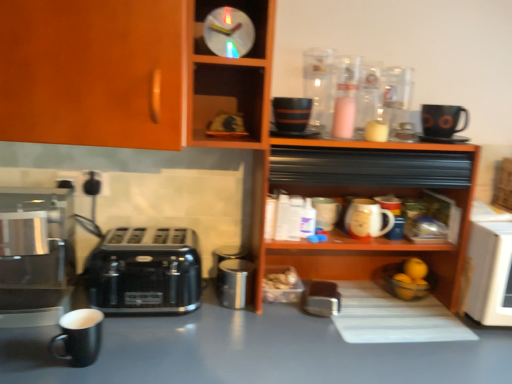
At what (x,y) coordinates should I click in order to perform the action: click on metallic silver canister at center. Please return your answer as a coordinate pair (x, y). The height and width of the screenshot is (384, 512). Looking at the image, I should click on (234, 283).

Identify the location of shiny metallic coffee maker at left. This screenshot has height=384, width=512. (35, 255).

The image size is (512, 384). What do you see at coordinates (144, 271) in the screenshot? I see `black plastic toaster at lower left` at bounding box center [144, 271].

Where is `matte wooden plate at upper center, which is the first cabinetry in right-to-left order`? matte wooden plate at upper center, which is the first cabinetry in right-to-left order is located at coordinates (x=230, y=77).

What do you see at coordinates (230, 77) in the screenshot? The image size is (512, 384). I see `matte wooden plate at upper center, the second cabinetry positioned from the left` at bounding box center [230, 77].

Image resolution: width=512 pixels, height=384 pixels. What do you see at coordinates (126, 74) in the screenshot?
I see `wooden cabinet at upper left, which ranks as the second cabinetry in right-to-left order` at bounding box center [126, 74].

The width and height of the screenshot is (512, 384). I want to click on translucent plastic clock at upper center, so click(228, 32).

What do you see at coordinates (228, 32) in the screenshot? I see `translucent plastic clock at upper center` at bounding box center [228, 32].

You are a GUI agent. You are given a task and a screenshot of the screen. Output one action in this format:
    pyautogui.click(x=<x>, y=<y>)
    Task: Click on the matte ceramic mug at shelf center
    This screenshot has width=512, height=384.
    Given the screenshot: What is the action you would take?
    pyautogui.click(x=367, y=219)

Which of these two, wooden cabinet at upper left, which ranks as the second cabinetry in right-to-left order, or matte wooden plate at upper center, the second cabinetry positioned from the left, is smaller?

With smaller size is matte wooden plate at upper center, the second cabinetry positioned from the left.

Which object is more forward, wooden cabinet at upper left, which ranks as the second cabinetry in right-to-left order, or matte wooden plate at upper center, the second cabinetry positioned from the left?

wooden cabinet at upper left, which ranks as the second cabinetry in right-to-left order, is more forward.

Looking at their sizes, would you say wooden cabinet at upper left, the first cabinetry in the left-to-right sequence, is wider or thinner than matte wooden plate at upper center, which is the first cabinetry in right-to-left order?

Clearly, wooden cabinet at upper left, the first cabinetry in the left-to-right sequence, has more width compared to matte wooden plate at upper center, which is the first cabinetry in right-to-left order.

From the image's perspective, between wooden cabinet at upper left, the first cabinetry in the left-to-right sequence, and matte wooden plate at upper center, the second cabinetry positioned from the left, who is located below?

wooden cabinet at upper left, the first cabinetry in the left-to-right sequence, is shown below in the image.

Which is correct: black matte table at lower left is inside shiny metallic coffee maker at left, or outside of it?

black matte table at lower left is outside shiny metallic coffee maker at left.

Is black matte table at lower left looking in the opposite direction of shiny metallic coffee maker at left?

No, black matte table at lower left is not facing the opposite direction of shiny metallic coffee maker at left.

Is black matte table at lower left taller or shorter than shiny metallic coffee maker at left?

In the image, black matte table at lower left appears to be taller than shiny metallic coffee maker at left.

From a real-world perspective, is black matte table at lower left physically located above or below shiny metallic coffee maker at left?

In terms of real-world spatial position, black matte table at lower left is below shiny metallic coffee maker at left.

Which of these two, metallic silver canister at center or black matte mug at lower left, is thinner?

black matte mug at lower left.

What's the angular difference between metallic silver canister at center and black matte mug at lower left's facing directions?

1.82 degrees.

Considering the sizes of objects metallic silver canister at center and black matte mug at lower left in the image provided, who is bigger, metallic silver canister at center or black matte mug at lower left?

metallic silver canister at center.

From a real-world perspective, does metallic silver canister at center stand above black matte mug at lower left?

Yes.

In the scene shown: Looking at the image, does black matte mug at lower left seem bigger or smaller compared to wooden shelf at upper center?

In the image, black matte mug at lower left appears to be smaller than wooden shelf at upper center.

How distant is black matte mug at lower left from wooden shelf at upper center?

black matte mug at lower left and wooden shelf at upper center are 29.77 inches apart from each other.

Would you consider black matte mug at lower left to be distant from wooden shelf at upper center?

No, black matte mug at lower left is not far away from wooden shelf at upper center.

From a real-world perspective, is black matte mug at lower left positioned over wooden shelf at upper center based on gravity?

Incorrect, from a real-world perspective, black matte mug at lower left is lower than wooden shelf at upper center.

Can we say black plastic toaster at lower left lies outside matte wooden plate at upper center, the second cabinetry positioned from the left?

Indeed, black plastic toaster at lower left is completely outside matte wooden plate at upper center, the second cabinetry positioned from the left.

What's the angular difference between black plastic toaster at lower left and matte wooden plate at upper center, the second cabinetry positioned from the left,'s facing directions?

black plastic toaster at lower left and matte wooden plate at upper center, the second cabinetry positioned from the left, are facing 0.000455 degrees away from each other.

From a real-world perspective, which is physically below, black plastic toaster at lower left or matte wooden plate at upper center, the second cabinetry positioned from the left?

Answer: black plastic toaster at lower left is physically lower.

Considering the relative sizes of black plastic toaster at lower left and matte wooden plate at upper center, which is the first cabinetry in right-to-left order, in the image provided, is black plastic toaster at lower left wider than matte wooden plate at upper center, which is the first cabinetry in right-to-left order,?

Incorrect, the width of black plastic toaster at lower left does not surpass that of matte wooden plate at upper center, which is the first cabinetry in right-to-left order.

Is black matte mug at lower left completely or partially inside black plastic toaster at lower left?

No, black matte mug at lower left is located outside of black plastic toaster at lower left.

Between black plastic toaster at lower left and black matte mug at lower left, which one is positioned behind?

Positioned behind is black plastic toaster at lower left.

Is there a large distance between black plastic toaster at lower left and black matte mug at lower left?

black plastic toaster at lower left is actually quite close to black matte mug at lower left.

Who is shorter, black plastic toaster at lower left or black matte mug at lower left?

black matte mug at lower left is shorter.

Is wooden cabinet at upper left, the first cabinetry in the left-to-right sequence, oriented away from shiny metallic coffee maker at left?

wooden cabinet at upper left, the first cabinetry in the left-to-right sequence, does not have its back to shiny metallic coffee maker at left.

Where is `coffee maker that is on the left side of wooden cabinet at upper left, the first cabinetry in the left-to-right sequence`? coffee maker that is on the left side of wooden cabinet at upper left, the first cabinetry in the left-to-right sequence is located at coordinates (35, 255).

How much distance is there between wooden cabinet at upper left, which ranks as the second cabinetry in right-to-left order, and shiny metallic coffee maker at left?

The distance of wooden cabinet at upper left, which ranks as the second cabinetry in right-to-left order, from shiny metallic coffee maker at left is 15.62 inches.

Does wooden cabinet at upper left, which ranks as the second cabinetry in right-to-left order, lie behind shiny metallic coffee maker at left?

No, it is not.

The height and width of the screenshot is (384, 512). I want to click on cabinetry in front of the matte wooden plate at upper center, the second cabinetry positioned from the left, so click(126, 74).

The width and height of the screenshot is (512, 384). Identify the location of table on the right of shiny metallic coffee maker at left. (253, 352).

Estimate the real-world distances between objects in this image. Which object is further from wooden cabinet at upper left, the first cabinetry in the left-to-right sequence, metallic silver canister at center or matte wooden plate at upper center, the second cabinetry positioned from the left?

Among the two, metallic silver canister at center is located further to wooden cabinet at upper left, the first cabinetry in the left-to-right sequence.

From the picture: Based on their spatial positions, is black matte table at lower left or matte wooden plate at upper center, which is the first cabinetry in right-to-left order, further from black plastic toaster at lower left?

matte wooden plate at upper center, which is the first cabinetry in right-to-left order, lies further to black plastic toaster at lower left than the other object.

Based on their spatial positions, is matte wooden plate at upper center, which is the first cabinetry in right-to-left order, or shiny metallic coffee maker at left closer to black plastic toaster at lower left?

shiny metallic coffee maker at left lies closer to black plastic toaster at lower left than the other object.

From the image, which object appears to be farther from metallic silver canister at center, black matte table at lower left or wooden cabinet at upper left, which ranks as the second cabinetry in right-to-left order?

wooden cabinet at upper left, which ranks as the second cabinetry in right-to-left order, is positioned further to the anchor metallic silver canister at center.

Estimate the real-world distances between objects in this image. Which object is further from shiny metallic coffee maker at left, black matte mug at lower left or wooden shelf at upper center?

wooden shelf at upper center lies further to shiny metallic coffee maker at left than the other object.

Consider the image. From the image, which object appears to be nearer to shiny metallic coffee maker at left, black matte table at lower left or metallic silver canister at center?

black matte table at lower left lies closer to shiny metallic coffee maker at left than the other object.

From the image, which object appears to be farther from metallic silver canister at center, black plastic toaster at lower left or shiny metallic coffee maker at left?

Based on the image, shiny metallic coffee maker at left appears to be further to metallic silver canister at center.

Based on their spatial positions, is black matte table at lower left or metallic silver canister at center closer to black plastic toaster at lower left?

black matte table at lower left lies closer to black plastic toaster at lower left than the other object.

At what (x,y) coordinates should I click in order to perform the action: click on coffee cup located between shiny metallic coffee maker at left and black plastic toaster at lower left in the left-right direction. Please return your answer as a coordinate pair (x, y). Looking at the image, I should click on (80, 336).

I want to click on coffee cup between wooden cabinet at upper left, which ranks as the second cabinetry in right-to-left order, and wooden shelf at upper center, so click(x=80, y=336).

You are a GUI agent. You are given a task and a screenshot of the screen. Output one action in this format:
    pyautogui.click(x=<x>, y=<y>)
    Task: Click on the toaster between matte wooden plate at upper center, the second cabinetry positioned from the left, and black matte mug at lower left in the up-down direction
    
    Given the screenshot: What is the action you would take?
    pyautogui.click(x=144, y=271)

Image resolution: width=512 pixels, height=384 pixels. I want to click on coffee cup that lies between translucent plastic clock at upper center and black matte table at lower left from top to bottom, so click(x=80, y=336).